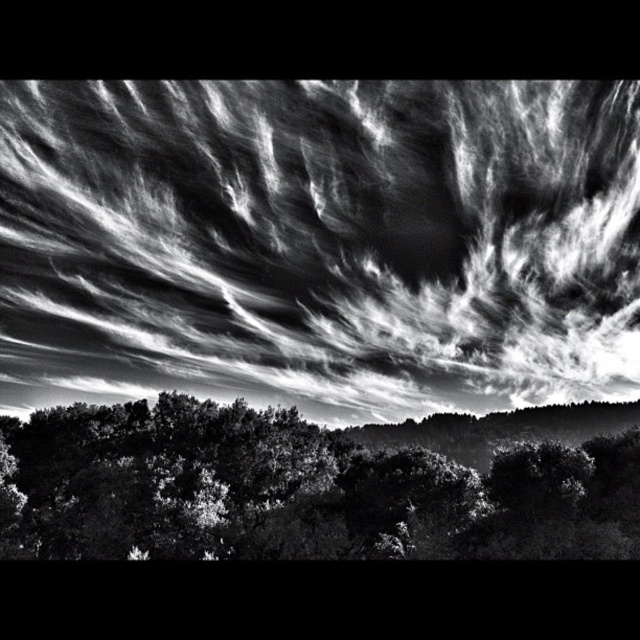
Who is more distant from viewer, (388, 246) or (483, 429)?

The point (483, 429) is behind.

What do you see at coordinates (321, 243) in the screenshot? Image resolution: width=640 pixels, height=640 pixels. I see `white textured clouds at upper center` at bounding box center [321, 243].

Locate an element on the screen. white textured clouds at upper center is located at coordinates (321, 243).